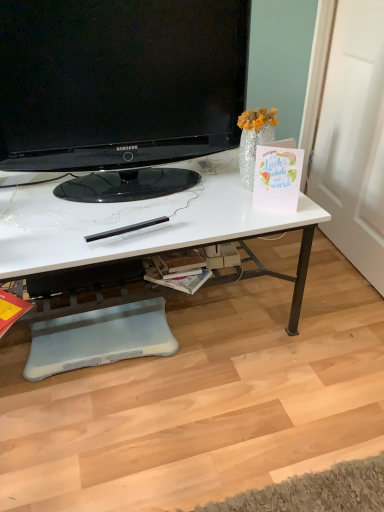
The image size is (384, 512). Describe the element at coordinates (135, 221) in the screenshot. I see `white glossy desk at center` at that location.

How much space does white paper magazine at center, acting as the 1th magazine starting from the right, occupy horizontally?

It is 7.11 inches.

The width and height of the screenshot is (384, 512). I want to click on black glossy television at upper center, so click(x=120, y=88).

Locate an element on the screen. The image size is (384, 512). white glossy desk at center is located at coordinates (135, 221).

Is matte yellow magazine at lower left, placed as the 2th magazine when sorted from right to left, bigger than black glossy television at upper center?

No, matte yellow magazine at lower left, placed as the 2th magazine when sorted from right to left, is not bigger than black glossy television at upper center.

How much distance is there between matte yellow magazine at lower left, placed as the 2th magazine when sorted from right to left, and black glossy television at upper center?

matte yellow magazine at lower left, placed as the 2th magazine when sorted from right to left, is 26.82 inches away from black glossy television at upper center.

Is matte yellow magazine at lower left, placed as the 2th magazine when sorted from right to left, further to camera compared to black glossy television at upper center?

Yes, matte yellow magazine at lower left, placed as the 2th magazine when sorted from right to left, is further from the camera.

What's the angular difference between white glossy desk at center and white paper magazine at center, acting as the 1th magazine starting from the right,'s facing directions?

44.9 degrees.

Based on the photo, from a real-world perspective, is white glossy desk at center positioned above or below white paper magazine at center, acting as the 1th magazine starting from the right?

In terms of real-world spatial position, white glossy desk at center is above white paper magazine at center, acting as the 1th magazine starting from the right.

Relative to white paper magazine at center, acting as the 1th magazine starting from the right, is white glossy desk at center in front or behind?

Visually, white glossy desk at center is located in front of white paper magazine at center, acting as the 1th magazine starting from the right.

Based on their sizes in the image, would you say white glossy desk at center is bigger or smaller than white paper magazine at center, the 2th magazine from the left?

white glossy desk at center is bigger than white paper magazine at center, the 2th magazine from the left.

How different are the orientations of white glossy desk at center and black glossy television at upper center in degrees?

The angle between the facing direction of white glossy desk at center and the facing direction of black glossy television at upper center is 3.32 degrees.

Is white glossy desk at center thinner than black glossy television at upper center?

In fact, white glossy desk at center might be wider than black glossy television at upper center.

From a real-world perspective, does white glossy desk at center stand above black glossy television at upper center?

No, from a real-world perspective, white glossy desk at center is not on top of black glossy television at upper center.

Relative to black glossy television at upper center, is white glossy desk at center in front or behind?

Visually, white glossy desk at center is located behind black glossy television at upper center.

Between black glossy television at upper center and white glossy desk at center, which one has smaller size?

With smaller size is black glossy television at upper center.

Between black glossy television at upper center and white glossy desk at center, which one has less height?

white glossy desk at center is shorter.

Does black glossy television at upper center appear on the left side of white glossy desk at center?

No, black glossy television at upper center is not to the left of white glossy desk at center.

What are the coordinates of `television on the right of the white glossy desk at center` in the screenshot? It's located at (120, 88).

Is white paper magazine at center, the 2th magazine from the left, taller or shorter than black glossy television at upper center?

In the image, white paper magazine at center, the 2th magazine from the left, appears to be shorter than black glossy television at upper center.

Is the position of white paper magazine at center, the 2th magazine from the left, less distant than that of black glossy television at upper center?

That is False.

Based on the photo, could you tell me if white paper magazine at center, the 2th magazine from the left, is turned towards black glossy television at upper center?

No, white paper magazine at center, the 2th magazine from the left, is not facing towards black glossy television at upper center.

Where is `television above the white paper magazine at center, the 2th magazine from the left (from a real-world perspective)`? television above the white paper magazine at center, the 2th magazine from the left (from a real-world perspective) is located at coordinates (120, 88).

In terms of size, does white glossy desk at center appear bigger or smaller than matte yellow magazine at lower left, placed as the 2th magazine when sorted from right to left?

white glossy desk at center is bigger than matte yellow magazine at lower left, placed as the 2th magazine when sorted from right to left.

In the scene shown: Which object is further away from the camera taking this photo, white glossy desk at center or matte yellow magazine at lower left, placed as the 2th magazine when sorted from right to left?

Positioned behind is matte yellow magazine at lower left, placed as the 2th magazine when sorted from right to left.

Is white glossy desk at center wider or thinner than matte yellow magazine at lower left, which is the 1th magazine from left to right?

Clearly, white glossy desk at center has more width compared to matte yellow magazine at lower left, which is the 1th magazine from left to right.

Is white glossy desk at center oriented towards matte yellow magazine at lower left, placed as the 2th magazine when sorted from right to left?

No, white glossy desk at center is not aimed at matte yellow magazine at lower left, placed as the 2th magazine when sorted from right to left.

Considering the relative sizes of white paper magazine at center, the 2th magazine from the left, and matte yellow magazine at lower left, placed as the 2th magazine when sorted from right to left, in the image provided, is white paper magazine at center, the 2th magazine from the left, thinner than matte yellow magazine at lower left, placed as the 2th magazine when sorted from right to left,?

No, white paper magazine at center, the 2th magazine from the left, is not thinner than matte yellow magazine at lower left, placed as the 2th magazine when sorted from right to left.

Is white paper magazine at center, the 2th magazine from the left, taller or shorter than matte yellow magazine at lower left, which is the 1th magazine from left to right?

In the image, white paper magazine at center, the 2th magazine from the left, appears to be shorter than matte yellow magazine at lower left, which is the 1th magazine from left to right.

Is white paper magazine at center, the 2th magazine from the left, facing away from matte yellow magazine at lower left, which is the 1th magazine from left to right?

That's not correct — white paper magazine at center, the 2th magazine from the left, is not looking away from matte yellow magazine at lower left, which is the 1th magazine from left to right.

Does white paper magazine at center, acting as the 1th magazine starting from the right, contain matte yellow magazine at lower left, placed as the 2th magazine when sorted from right to left?

That's incorrect, matte yellow magazine at lower left, placed as the 2th magazine when sorted from right to left, is not inside white paper magazine at center, acting as the 1th magazine starting from the right.

From the image's perspective, starting from the black glossy television at upper center, which magazine is the 2nd one below? Please provide its 2D coordinates.

[(11, 310)]

Find the location of a particular element. desk on the left of the white paper magazine at center, the 2th magazine from the left is located at coordinates (135, 221).

From the image, which object appears to be nearer to white glossy desk at center, white paper magazine at center, the 2th magazine from the left, or black glossy television at upper center?

black glossy television at upper center is positioned closer to the anchor white glossy desk at center.

Considering their positions, is matte yellow magazine at lower left, which is the 1th magazine from left to right, positioned closer to black glossy television at upper center than white glossy desk at center?

white glossy desk at center is closer to black glossy television at upper center.

Looking at the image, which one is located closer to white paper magazine at center, the 2th magazine from the left, black glossy television at upper center or white glossy desk at center?

white glossy desk at center is closer to white paper magazine at center, the 2th magazine from the left.

From the image, which object appears to be nearer to black glossy television at upper center, white paper magazine at center, acting as the 1th magazine starting from the right, or matte yellow magazine at lower left, placed as the 2th magazine when sorted from right to left?

white paper magazine at center, acting as the 1th magazine starting from the right, is closer to black glossy television at upper center.

Which object lies nearer to the anchor point black glossy television at upper center, matte yellow magazine at lower left, which is the 1th magazine from left to right, or white paper magazine at center, the 2th magazine from the left?

white paper magazine at center, the 2th magazine from the left, is closer to black glossy television at upper center.

Based on their spatial positions, is black glossy television at upper center or matte yellow magazine at lower left, which is the 1th magazine from left to right, closer to white paper magazine at center, the 2th magazine from the left?

matte yellow magazine at lower left, which is the 1th magazine from left to right.

Estimate the real-world distances between objects in this image. Which object is closer to white glossy desk at center, black glossy television at upper center or matte yellow magazine at lower left, placed as the 2th magazine when sorted from right to left?

black glossy television at upper center.

Based on their spatial positions, is white glossy desk at center or white paper magazine at center, acting as the 1th magazine starting from the right, further from black glossy television at upper center?

white paper magazine at center, acting as the 1th magazine starting from the right.

What are the coordinates of `desk between black glossy television at upper center and matte yellow magazine at lower left, placed as the 2th magazine when sorted from right to left, in the vertical direction` in the screenshot? It's located at (135, 221).

I want to click on desk between matte yellow magazine at lower left, placed as the 2th magazine when sorted from right to left, and white paper magazine at center, acting as the 1th magazine starting from the right, in the horizontal direction, so click(x=135, y=221).

Locate an element on the screen. magazine between black glossy television at upper center and matte yellow magazine at lower left, placed as the 2th magazine when sorted from right to left, vertically is located at coordinates (180, 280).

This screenshot has width=384, height=512. In order to click on desk that lies between black glossy television at upper center and white paper magazine at center, acting as the 1th magazine starting from the right, from top to bottom in this screenshot , I will do `click(135, 221)`.